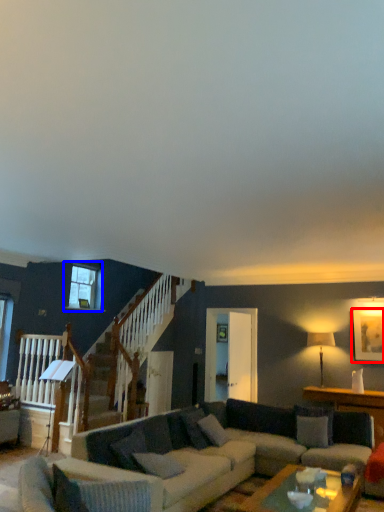
Question: Which of the following is the farthest to the observer, picture frame (highlighted by a red box) or window (highlighted by a blue box)?

Choices:
 (A) picture frame
 (B) window

Answer: (B)